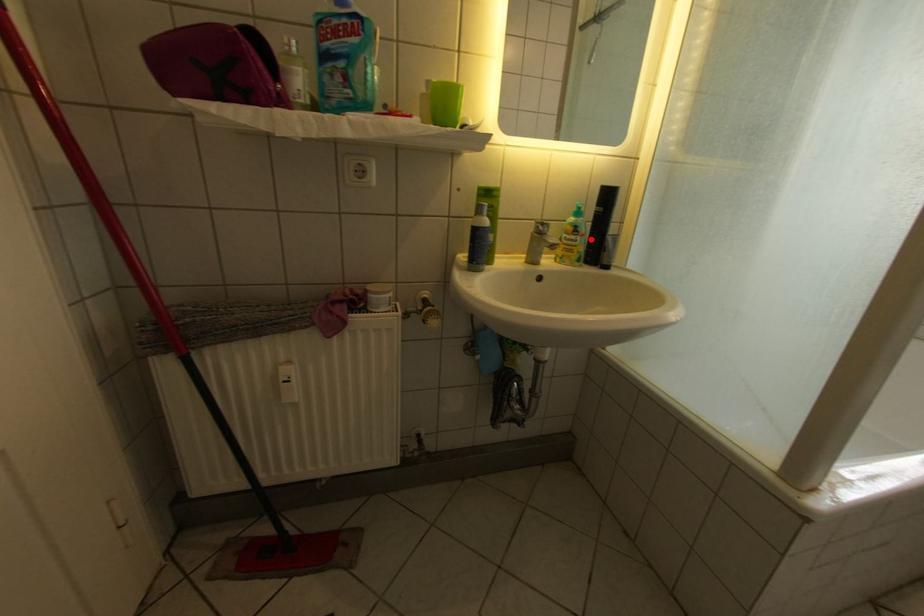
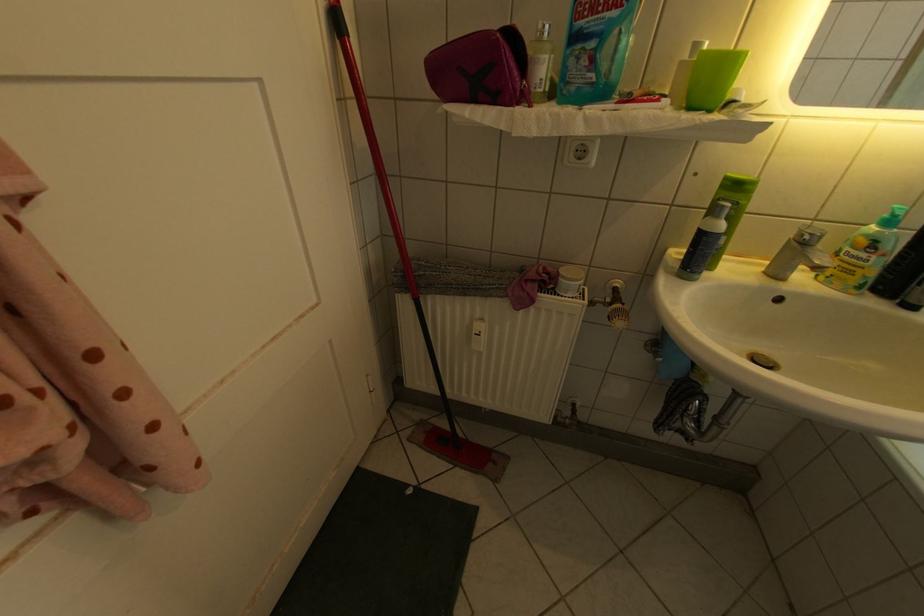
Question: I am providing you with two images of the same scene from different viewpoints. A red point is shown in image1. For the corresponding object point in image2, is it positioned nearer or farther from the camera?

Choices:
 (A) Nearer
 (B) Farther

Answer: (B)